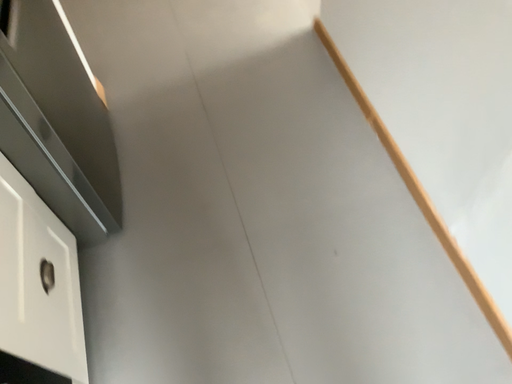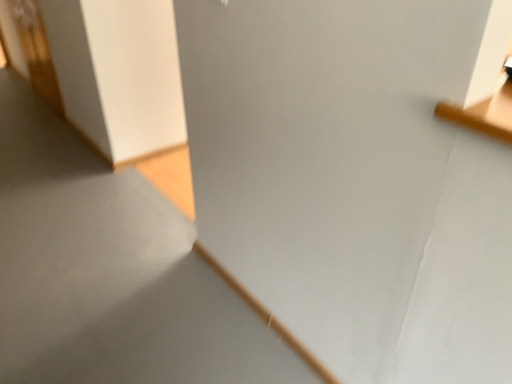
Question: How did the camera likely rotate when shooting the video?

Choices:
 (A) rotated right
 (B) rotated left

Answer: (A)